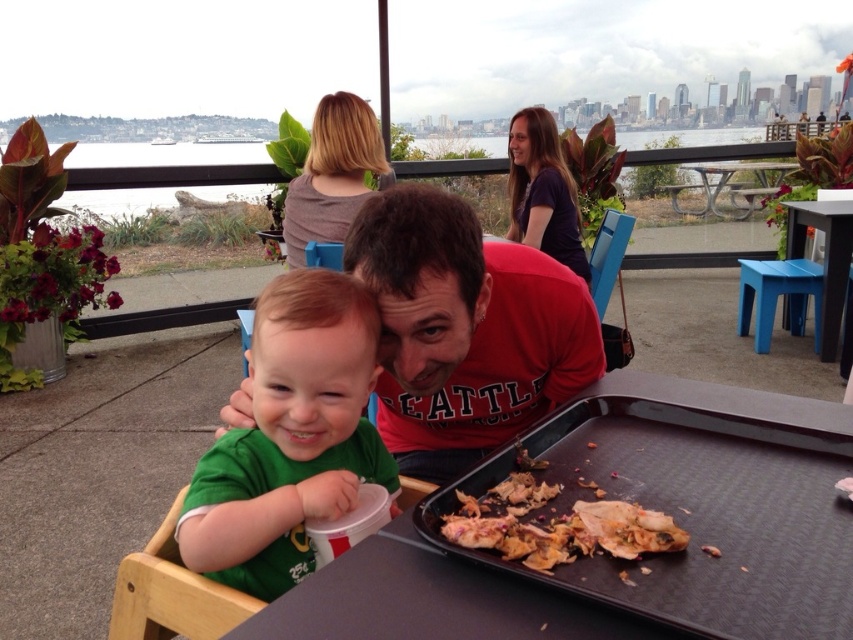
You are a customer at this waterfront restaurant and want to place your phone on the table. The red matte shirt at center and the brown crumbly pizza at lower right are already on the table. Where should you place your phone to ensure it doesn t get in the way of the shirt or the pizza?

Place the phone away from both the red matte shirt at center and the brown crumbly pizza at lower right. Since the red matte shirt at center is to the left of the brown crumbly pizza at lower right, positioning it to the right of the pizza or to the left of the shirt would keep it out of the way.

You are a customer at the waterfront restaurant and want to take a photo of the scenic view through the large window or glass barrier. However, there is an object blocking your view at point (289, 436). Which object is blocking your view?

The green matte shirt at center is located at point (289, 436), so the object blocking your view is the green matte shirt at center.